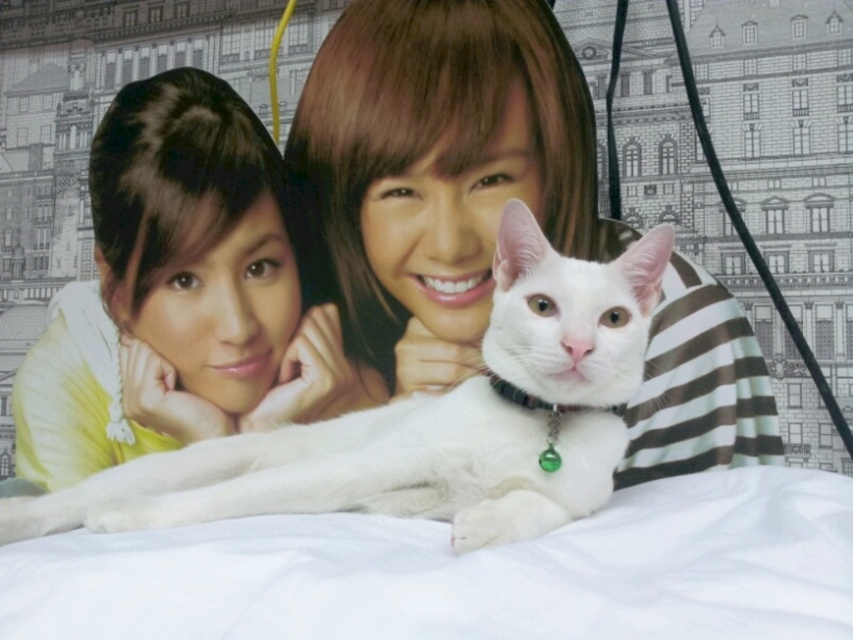
You are a photographer trying to capture a closeup of the smooth brown hair at center and the white fur cat at center. Which subject should you focus on first if you want to ensure both are in frame without moving the camera?

You should focus on the white fur cat at center first because it occupies more space than the smooth brown hair at center, so it will take up more of the frame and ensure both subjects are included.

You are standing in front of the image and want to determine which of the two points, point (288, 225) or point (346, 436), is closer to you. Based on the scene description, which point is nearer?

Point (288, 225) is closer to you because it is further to the viewer than point (346, 436).

You are an interior designer planning to place a decorative item between the smooth brown hair at center and the smooth yellow shirt at upper left. Which object should you place closer to the edge to ensure the item fits within the space?

The smooth brown hair at center is wider than the smooth yellow shirt at upper left. To ensure the decorative item fits, place it closer to the edge near the smooth yellow shirt at upper left since it has a smaller width.